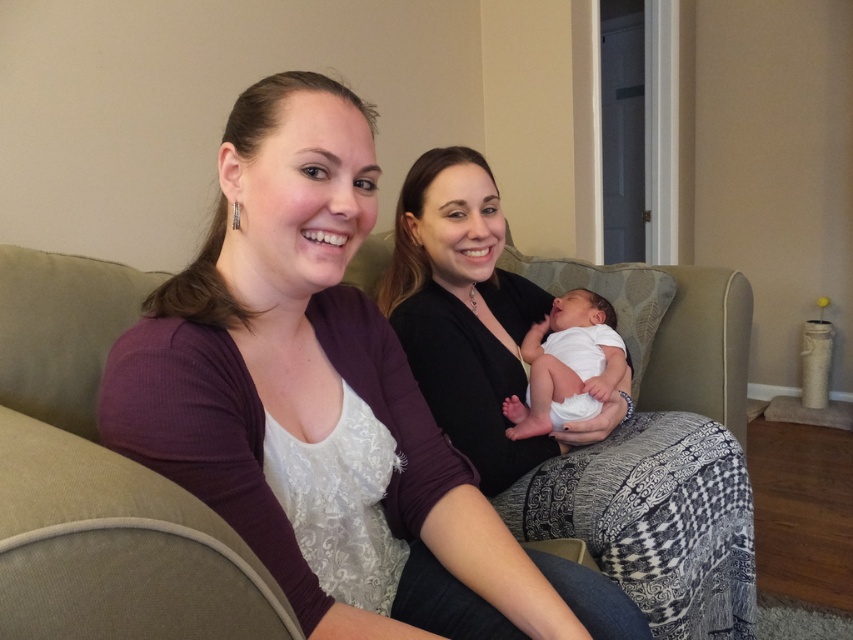
You are standing in the room and want to place a small decoration at point [323,404]. Which object is at that location?

The point [323,404] is on the purple ribbed cardigan at left.

Looking at this image, you are a photographer standing in front of the purple ribbed cardigan at left. You want to take a closeup shot of it without moving any objects. What is the minimum distance you need to move forward to get the cardigan into focus?

The minimum distance you need to move forward is 25.85 inches to get the purple ribbed cardigan at left into focus.